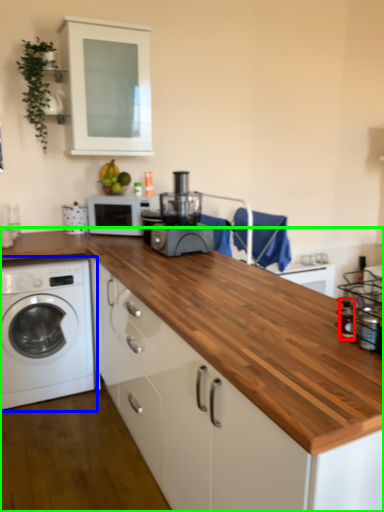
Question: Estimate the real-world distances between objects in this image. Which object is farther from bottle (highlighted by a red box), washing machine (highlighted by a blue box) or countertop (highlighted by a green box)?

Choices:
 (A) washing machine
 (B) countertop

Answer: (A)